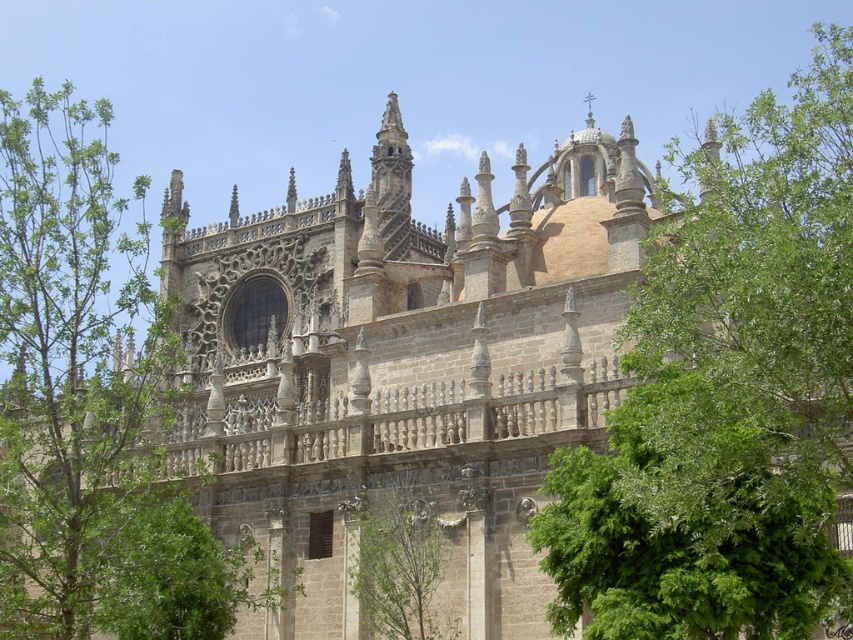
Question: Is green leafy tree at upper right smaller than green leafy tree at left?

Choices:
 (A) yes
 (B) no

Answer: (B)

Question: Which of the following is the closest to the observer?

Choices:
 (A) (445, 547)
 (B) (822, 51)

Answer: (A)

Question: Based on their relative distances, which object is farther from the green leafy tree at upper right?

Choices:
 (A) green leafy tree at center
 (B) green leafy tree at left

Answer: (B)

Question: Which point appears closest to the camera in this image?

Choices:
 (A) (392, 556)
 (B) (693, 420)
 (C) (61, 179)

Answer: (B)

Question: Is green leafy tree at upper right positioned at the back of green leafy tree at left?

Choices:
 (A) yes
 (B) no

Answer: (B)

Question: Is the position of green leafy tree at left less distant than that of green leafy tree at center?

Choices:
 (A) yes
 (B) no

Answer: (A)